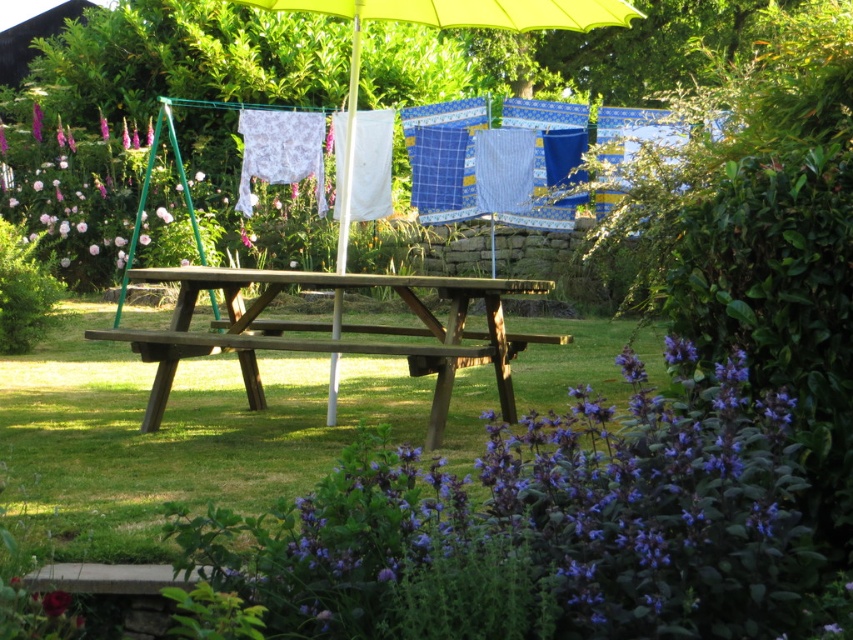
Question: Can you confirm if wooden picnic table at center is positioned below yellow fabric umbrella at center?

Choices:
 (A) yes
 (B) no

Answer: (A)

Question: Which of the following is the farthest from the observer?

Choices:
 (A) purple leafy plant at lower center
 (B) purple matte flower at lower left
 (C) yellow fabric umbrella at center

Answer: (B)

Question: Does wooden picnic table at center have a larger size compared to purple matte flower at lower left?

Choices:
 (A) no
 (B) yes

Answer: (B)

Question: Which of these objects is positioned farthest from the yellow fabric umbrella at center?

Choices:
 (A) wooden picnic table at center
 (B) purple matte flower at lower center

Answer: (B)

Question: Which object appears closest to the camera in this image?

Choices:
 (A) yellow fabric umbrella at center
 (B) purple matte flower at lower left

Answer: (A)

Question: From the image, what is the correct spatial relationship of yellow fabric umbrella at center in relation to wooden bench at center?

Choices:
 (A) right
 (B) left

Answer: (A)